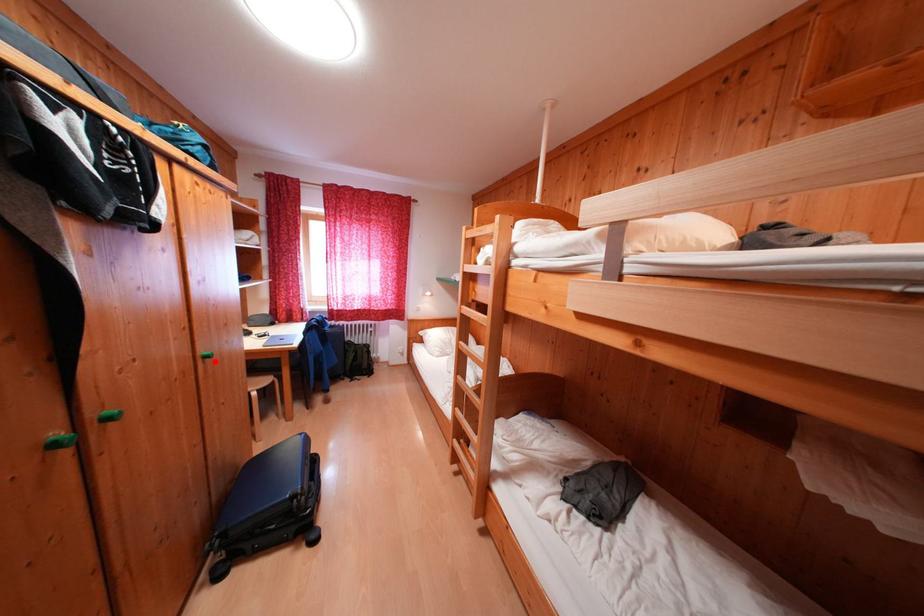
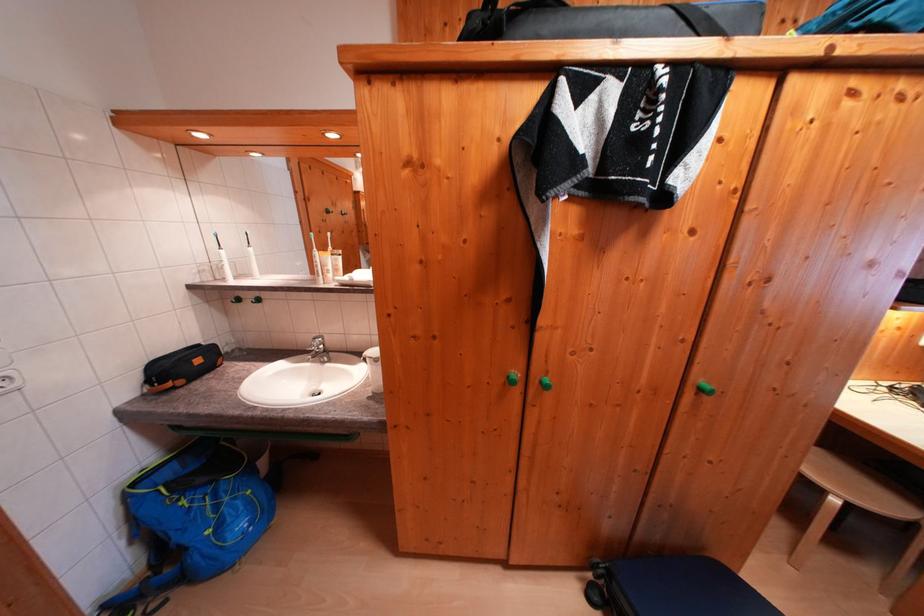
Question: I am providing you with two images of the same scene from different viewpoints. Image1 has a red point marked. In image2, the corresponding 3D location appears at what relative position? Reply with the corresponding letter.

Choices:
 (A) Closer
 (B) Farther

Answer: (B)